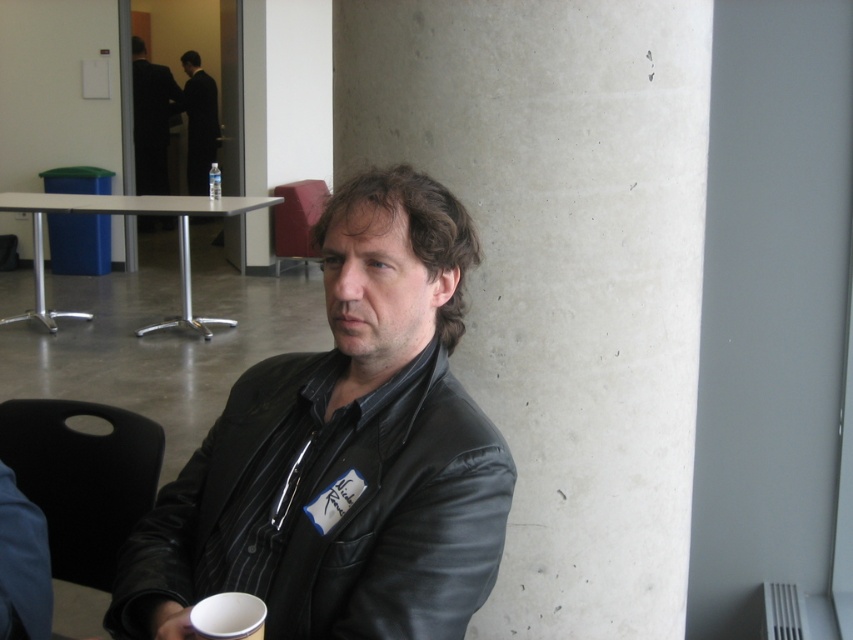
Question: Is black leather jacket at center smaller than clear plastic bottle at center?

Choices:
 (A) yes
 (B) no

Answer: (B)

Question: Which is farther from the black leather jacket at center?

Choices:
 (A) velvet-like red chair at center
 (B) concrete pillar at center

Answer: (A)

Question: Which object is closer to the camera taking this photo?

Choices:
 (A) concrete pillar at center
 (B) black leather jacket at center
 (C) dark suit at upper left
 (D) black plastic chair at lower left

Answer: (B)

Question: Considering the relative positions of black suit at upper left and clear plastic bottle at center in the image provided, where is black suit at upper left located with respect to clear plastic bottle at center?

Choices:
 (A) left
 (B) right

Answer: (A)

Question: Is dark suit at upper left closer to camera compared to black suit at upper left?

Choices:
 (A) yes
 (B) no

Answer: (A)

Question: Which point appears closest to the camera in this image?

Choices:
 (A) (260, 440)
 (B) (143, 477)
 (C) (154, 161)

Answer: (A)